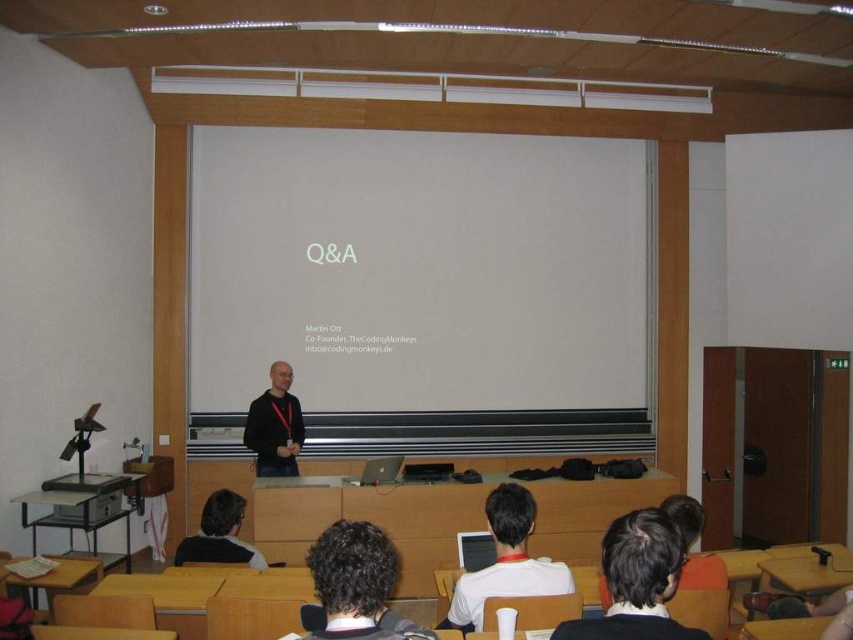
Which is above, white matte projection screen at center or black matte shirt at center?

white matte projection screen at center is above.

Between white matte projection screen at center and black matte shirt at center, which one has less height?

black matte shirt at center is shorter.

What do you see at coordinates (421, 284) in the screenshot? I see `white matte projection screen at center` at bounding box center [421, 284].

Locate an element on the screen. This screenshot has height=640, width=853. white matte projection screen at center is located at coordinates (421, 284).

Does white matte projection screen at center have a greater width compared to white matte laptop at lower center?

Correct, the width of white matte projection screen at center exceeds that of white matte laptop at lower center.

Between point (306, 257) and point (500, 516), which one is positioned behind?

The point (306, 257) is more distant.

Locate an element on the screen. This screenshot has height=640, width=853. white matte projection screen at center is located at coordinates (421, 284).

Between white matte laptop at lower center and black matte shirt at center, which one is positioned higher?

Positioned higher is black matte shirt at center.

Can you confirm if white matte laptop at lower center is positioned to the right of black matte shirt at center?

Indeed, white matte laptop at lower center is positioned on the right side of black matte shirt at center.

This screenshot has width=853, height=640. Find the location of `white matte laptop at lower center`. white matte laptop at lower center is located at coordinates (505, 561).